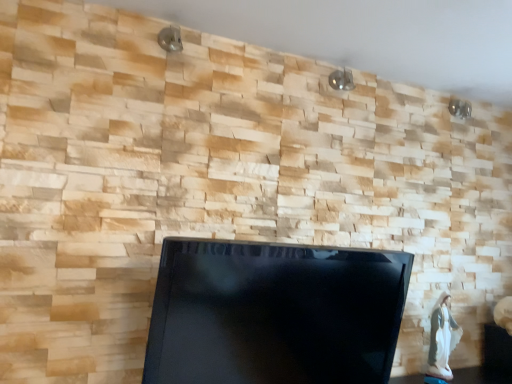
Describe the element at coordinates (442, 338) in the screenshot. I see `white porcelain statue at lower right` at that location.

Measure the distance between point [440,338] and camera.

They are 2.14 meters apart.

Find the location of a particular element. white porcelain statue at lower right is located at coordinates (442, 338).

Where is `white porcelain statue at lower right`? white porcelain statue at lower right is located at coordinates (442, 338).